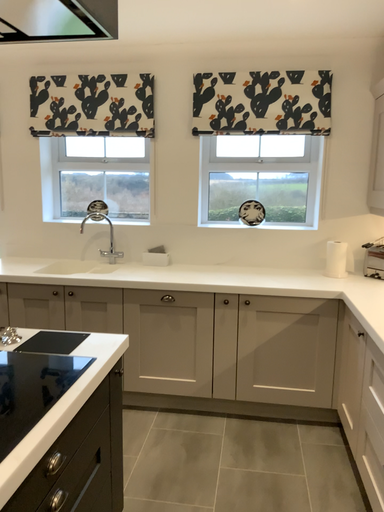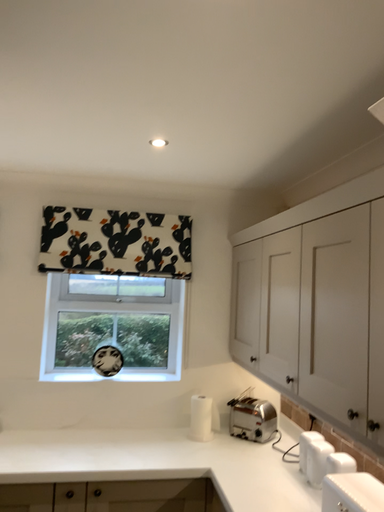
Question: How did the camera likely rotate when shooting the video?

Choices:
 (A) rotated upward
 (B) rotated downward

Answer: (A)